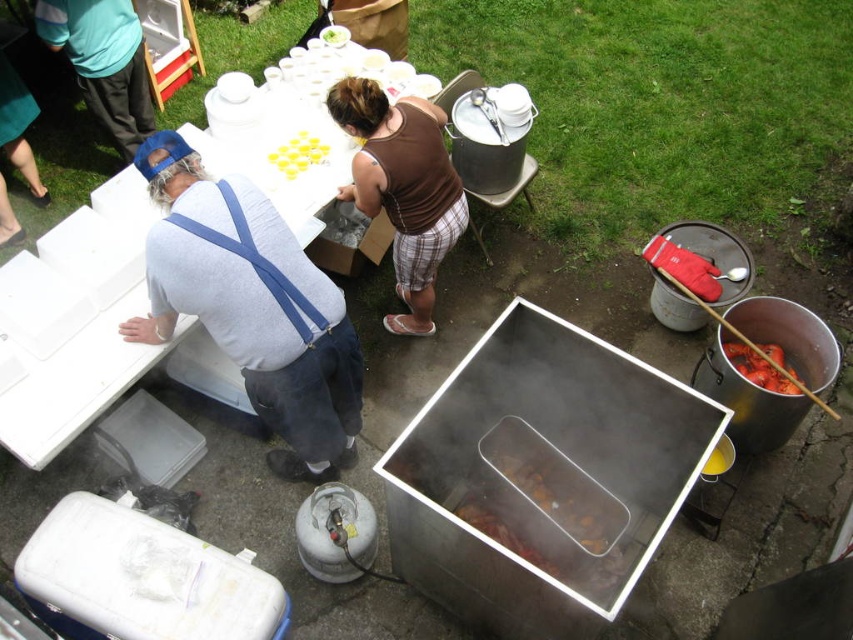
Question: Does brown cotton tank top at center have a smaller size compared to shiny silver lobster at right?

Choices:
 (A) no
 (B) yes

Answer: (A)

Question: Which point appears closest to the camera in this image?

Choices:
 (A) (422, 241)
 (B) (265, 115)

Answer: (A)

Question: Does gray cotton shirt at upper left have a smaller size compared to shiny silver lobster at right?

Choices:
 (A) yes
 (B) no

Answer: (B)

Question: Which of these objects is positioned closest to the green cotton shirt at upper left?

Choices:
 (A) yellow plastic cups at upper center
 (B) white plastic table at upper left

Answer: (B)

Question: Which object is closer to the camera taking this photo?

Choices:
 (A) gray cotton shirt at upper left
 (B) white plastic table at upper left
 (C) yellow plastic cups at upper center

Answer: (A)

Question: Can you confirm if gray cotton shirt at upper left is positioned to the right of brown cotton tank top at center?

Choices:
 (A) yes
 (B) no

Answer: (B)